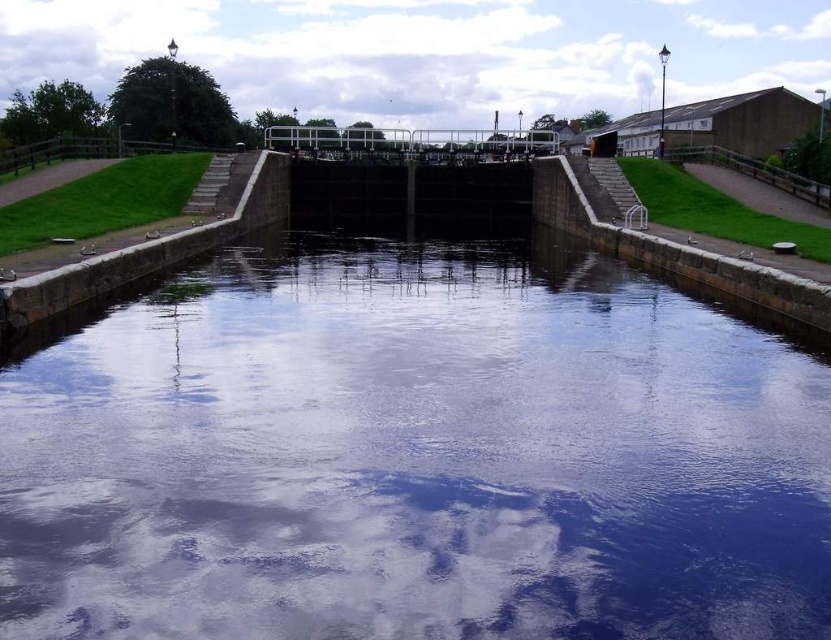
Is transparent water at center closer to the viewer compared to white fluffy cloud at upper center?

Yes, it is in front of white fluffy cloud at upper center.

In the scene shown: Can you confirm if transparent water at center is wider than white fluffy cloud at upper center?

No, transparent water at center is not wider than white fluffy cloud at upper center.

Locate an element on the screen. The width and height of the screenshot is (831, 640). transparent water at center is located at coordinates (414, 456).

Find the location of a particular element. transparent water at center is located at coordinates (414, 456).